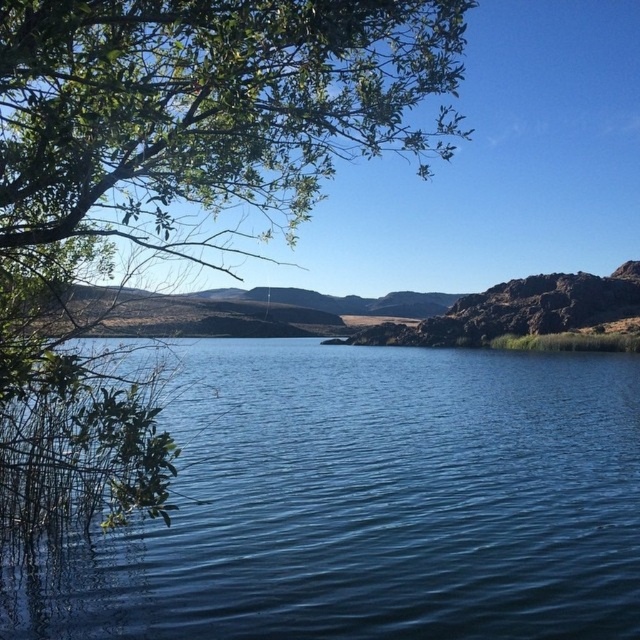
In the scene shown: Which is more to the left, blue liquid water at center or green leafy tree at upper left?

green leafy tree at upper left

Is blue liquid water at center smaller than green leafy tree at upper left?

No, blue liquid water at center is not smaller than green leafy tree at upper left.

Image resolution: width=640 pixels, height=640 pixels. What are the coordinates of `blue liquid water at center` in the screenshot? It's located at (368, 502).